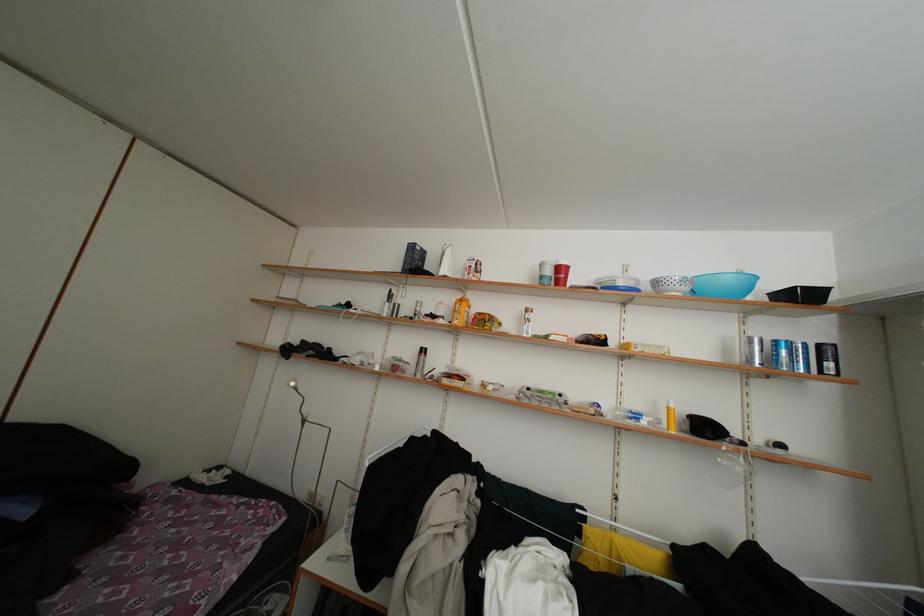
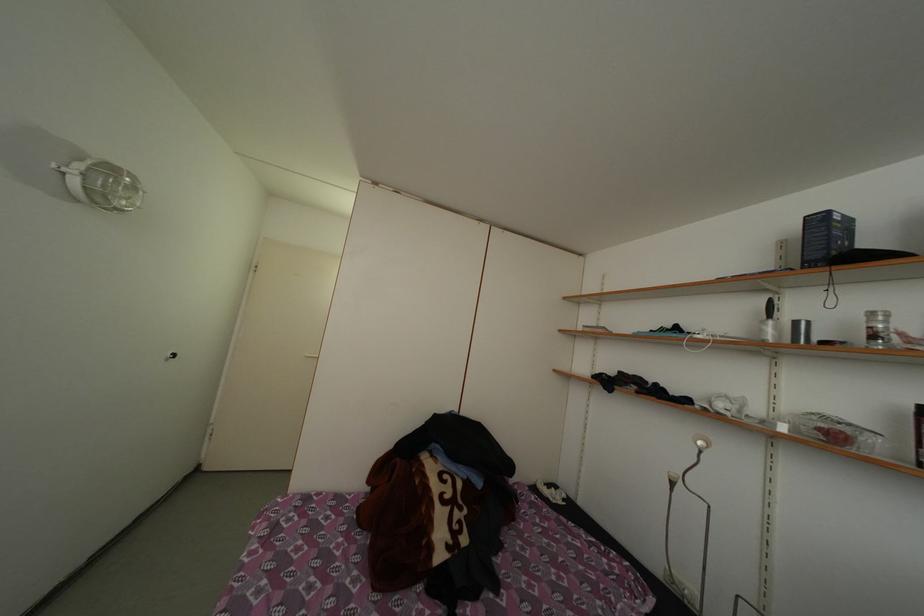
Question: The first image is from the beginning of the video and the second image is from the end. How did the camera likely rotate when shooting the video?

Choices:
 (A) Left
 (B) Right
 (C) Up
 (D) Down

Answer: (A)